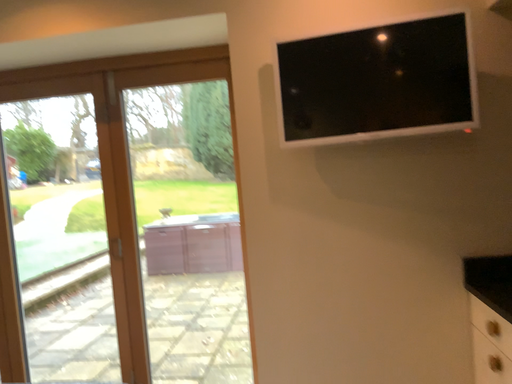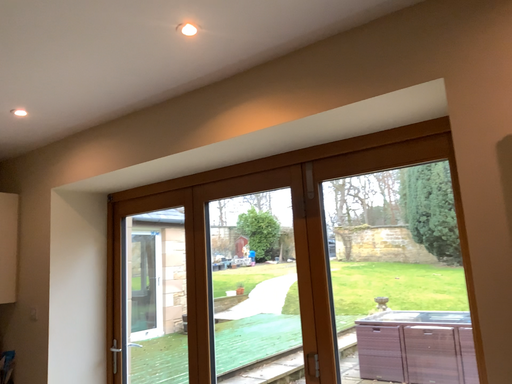
Question: How did the camera likely rotate when shooting the video?

Choices:
 (A) rotated left
 (B) rotated right

Answer: (A)